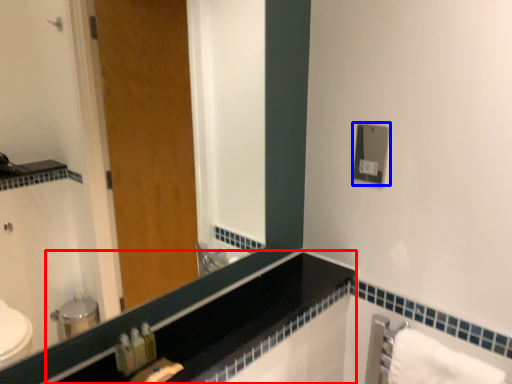
Question: Which object is further to the camera taking this photo, counter top (highlighted by a red box) or electric outlet (highlighted by a blue box)?

Choices:
 (A) counter top
 (B) electric outlet

Answer: (B)